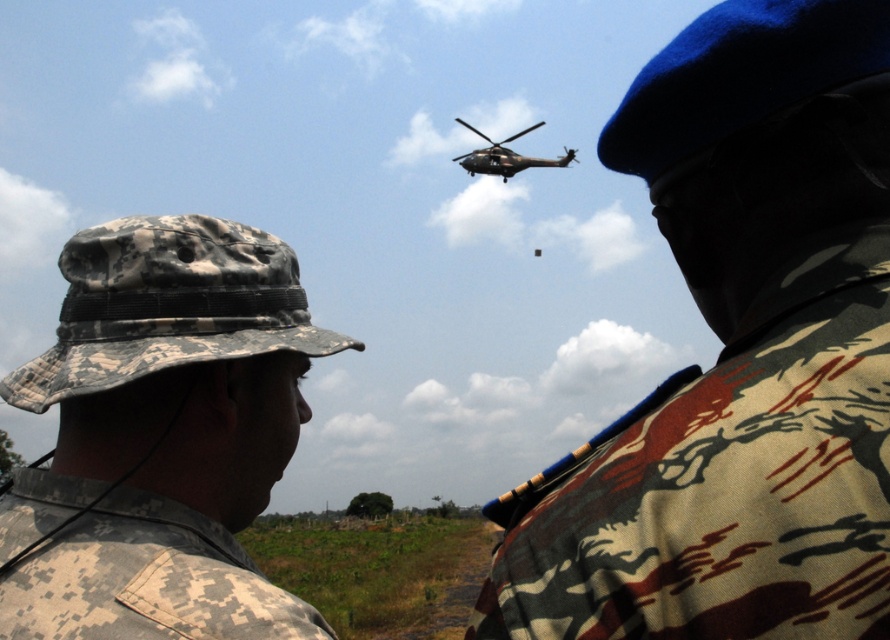
Question: Is digital camo fabric at lower left below dark gray matte helicopter at upper center?

Choices:
 (A) no
 (B) yes

Answer: (B)

Question: Considering the real-world distances, which object is closest to the digital camouflage hat at left?

Choices:
 (A) camo fabric uniform at upper right
 (B) digital camo fabric at lower left

Answer: (B)

Question: Does digital camouflage hat at left appear under digital camo fabric at lower left?

Choices:
 (A) yes
 (B) no

Answer: (B)

Question: Which object appears closest to the camera in this image?

Choices:
 (A) dark gray matte helicopter at upper center
 (B) digital camouflage hat at left

Answer: (B)

Question: Does digital camouflage hat at left appear on the left side of digital camo fabric at lower left?

Choices:
 (A) yes
 (B) no

Answer: (A)

Question: Which object appears closest to the camera in this image?

Choices:
 (A) dark gray matte helicopter at upper center
 (B) camo fabric uniform at upper right
 (C) digital camo fabric at lower left
 (D) digital camouflage hat at left

Answer: (B)